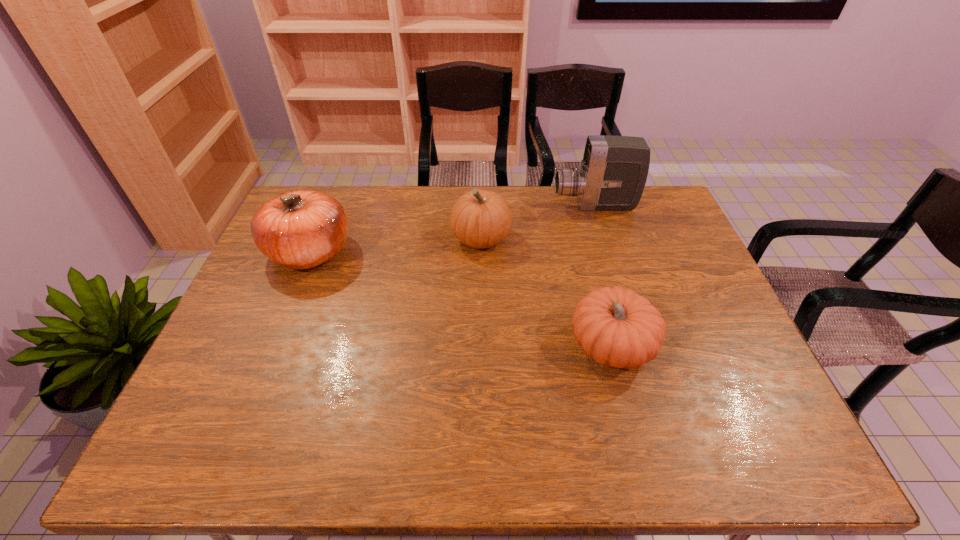
Find the location of a particular element. This screenshot has width=960, height=540. blank area in the image that satisfies the following two spatial constraints: 1. on the stem of the second pumpkin from right to left; 2. on the left side of the rightmost pumpkin is located at coordinates (481, 346).

Identify the location of free spot that satisfies the following two spatial constraints: 1. at the front of the farthest object, highlighting the lens; 2. on the front side of the nearest object. This screenshot has height=540, width=960. (638, 346).